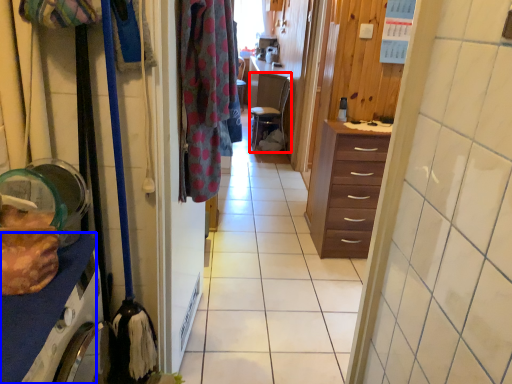
Question: Which object appears closest to the camera in this image, chair (highlighted by a red box) or cabinetry (highlighted by a blue box)?

Choices:
 (A) chair
 (B) cabinetry

Answer: (B)